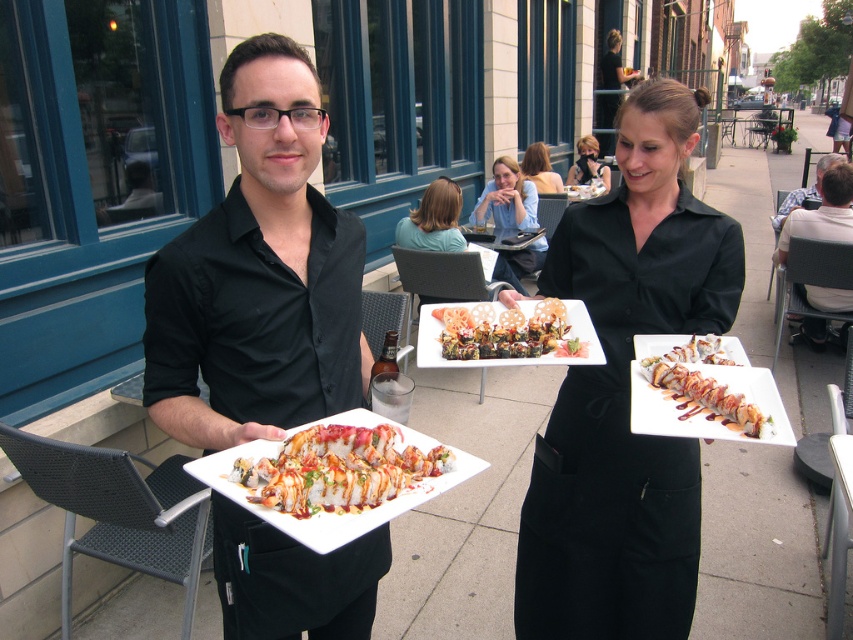
Can you confirm if black matte uniform at center is positioned below light blue shirt at center?

Yes.

Can you confirm if black matte uniform at center is bigger than light blue shirt at center?

Correct, black matte uniform at center is larger in size than light blue shirt at center.

Is point (653, 568) behind point (410, 228)?

That is False.

You are a GUI agent. You are given a task and a screenshot of the screen. Output one action in this format:
    pyautogui.click(x=<x>, y=<y>)
    Task: Click on the black matte uniform at center
    This screenshot has height=640, width=853.
    Given the screenshot: What is the action you would take?
    pyautogui.click(x=625, y=392)

Can you confirm if smokey brown glazed sushi at center is wider than matte blue shirt at center?

No.

Between smokey brown glazed sushi at center and matte blue shirt at center, which one is positioned higher?

Positioned higher is matte blue shirt at center.

The height and width of the screenshot is (640, 853). I want to click on smokey brown glazed sushi at center, so click(703, 394).

Can you confirm if matte black shirt at center is thinner than sleek white plate at center?

Yes, matte black shirt at center is thinner than sleek white plate at center.

Who is more forward, (228, 282) or (325, 513)?

Positioned in front is point (325, 513).

This screenshot has width=853, height=640. What are the coordinates of `matte black shirt at center` in the screenshot? It's located at (259, 273).

Where is `matte black shirt at center`? The height and width of the screenshot is (640, 853). matte black shirt at center is located at coordinates (259, 273).